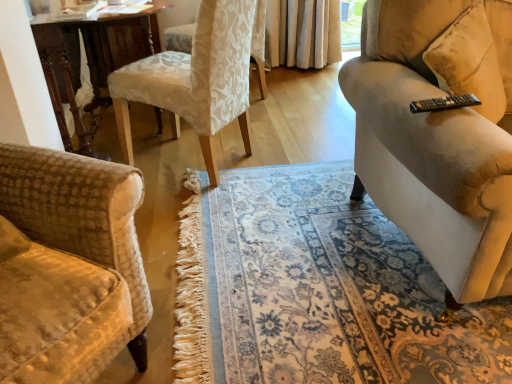
Question: Are wooden table at center and white fabric chair at center, which is the 2th chair from back to front, far apart?

Choices:
 (A) no
 (B) yes

Answer: (A)

Question: Is wooden table at center directly adjacent to white fabric chair at center, which is the 2th chair from back to front?

Choices:
 (A) yes
 (B) no

Answer: (B)

Question: Considering the relative positions of wooden table at center and white fabric chair at center, which is the 2th chair from back to front, in the image provided, is wooden table at center to the left of white fabric chair at center, which is the 2th chair from back to front, from the viewer's perspective?

Choices:
 (A) no
 (B) yes

Answer: (B)

Question: Is the position of wooden table at center more distant than that of white fabric chair at center, which is the 2th chair from back to front?

Choices:
 (A) no
 (B) yes

Answer: (B)

Question: Is the position of wooden table at center less distant than that of white fabric chair at center, the 1th chair from the front?

Choices:
 (A) yes
 (B) no

Answer: (B)

Question: From the image's perspective, is wooden table at center located above or below white damask fabric chair at upper center, arranged as the first chair when viewed from the back?

Choices:
 (A) below
 (B) above

Answer: (A)

Question: Is wooden table at center situated inside white damask fabric chair at upper center, the 2th chair from the front, or outside?

Choices:
 (A) outside
 (B) inside

Answer: (A)

Question: Looking at their shapes, would you say wooden table at center is wider or thinner than white damask fabric chair at upper center, the 2th chair from the front?

Choices:
 (A) wide
 (B) thin

Answer: (A)

Question: From a real-world perspective, is wooden table at center above or below white damask fabric chair at upper center, arranged as the first chair when viewed from the back?

Choices:
 (A) above
 (B) below

Answer: (A)

Question: Is white damask fabric chair at upper center, the 2th chair from the front, taller or shorter than wooden table at center?

Choices:
 (A) tall
 (B) short

Answer: (B)

Question: In the image, is white damask fabric chair at upper center, the 2th chair from the front, on the left side or the right side of wooden table at center?

Choices:
 (A) right
 (B) left

Answer: (A)

Question: Does point (262, 11) appear closer or farther from the camera than point (96, 124)?

Choices:
 (A) closer
 (B) farther

Answer: (B)

Question: Looking at their shapes, would you say white damask fabric chair at upper center, the 2th chair from the front, is wider or thinner than wooden table at center?

Choices:
 (A) wide
 (B) thin

Answer: (B)

Question: Considering the positions of white fabric chair at center, the 1th chair from the front, and white damask fabric chair at upper center, arranged as the first chair when viewed from the back, in the image, is white fabric chair at center, the 1th chair from the front, wider or thinner than white damask fabric chair at upper center, arranged as the first chair when viewed from the back,?

Choices:
 (A) wide
 (B) thin

Answer: (B)

Question: From their relative heights in the image, would you say white fabric chair at center, the 1th chair from the front, is taller or shorter than white damask fabric chair at upper center, arranged as the first chair when viewed from the back?

Choices:
 (A) tall
 (B) short

Answer: (A)